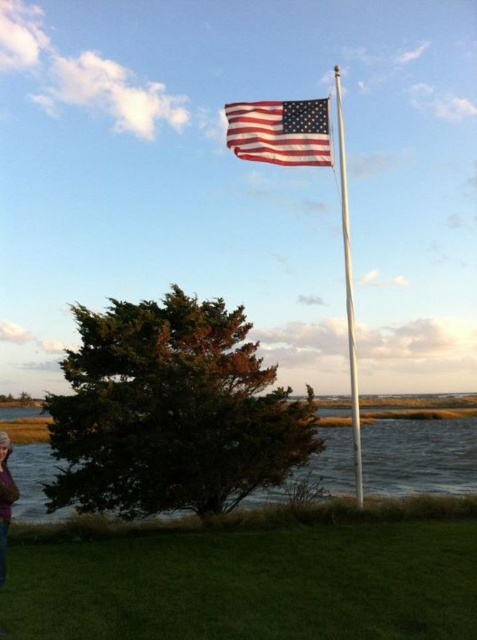
You are standing in the outdoor scene and want to place a small garden gnome exactly between the green grass at lower center and the purple sweater at lower left. Which object will the gnome be closer to, and why?

The gnome will be closer to the purple sweater at lower left because the green grass at lower center is taller than the purple sweater at lower left, meaning the distance between them is determined by their heights.

You are a photographer setting up equipment in the scene. You have a camera that can only capture objects wider than 1 meter. Can both the silver metallic flag pole at upper center and the purple sweater at lower left fit into your camera frame if they need to be wider than 1 meter?

The silver metallic flag pole at upper center is wider than the purple sweater at lower left. However, without knowing the exact width measurements of both objects, it is impossible to determine if they individually meet the 1 meter requirement. The camera may or may not capture them depending on their actual widths.